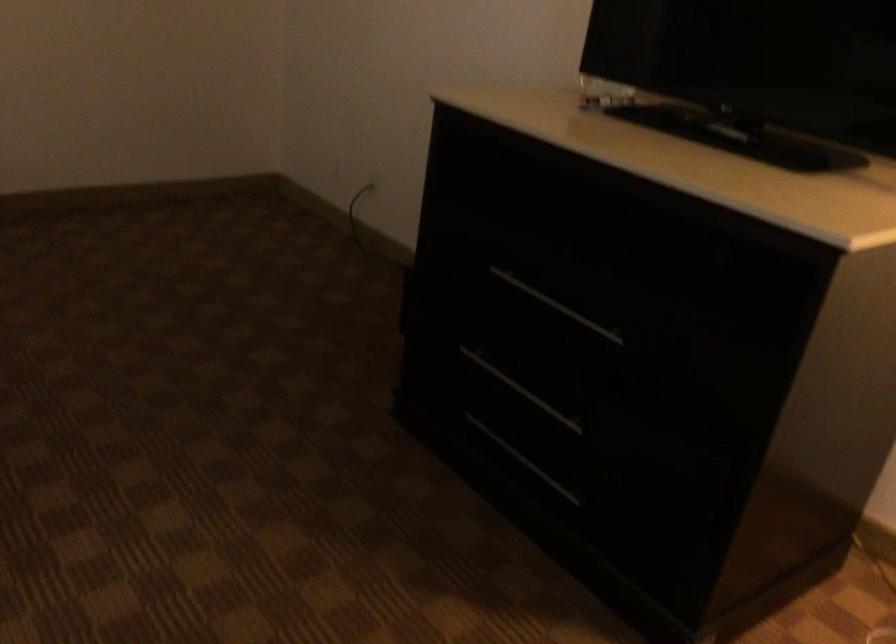
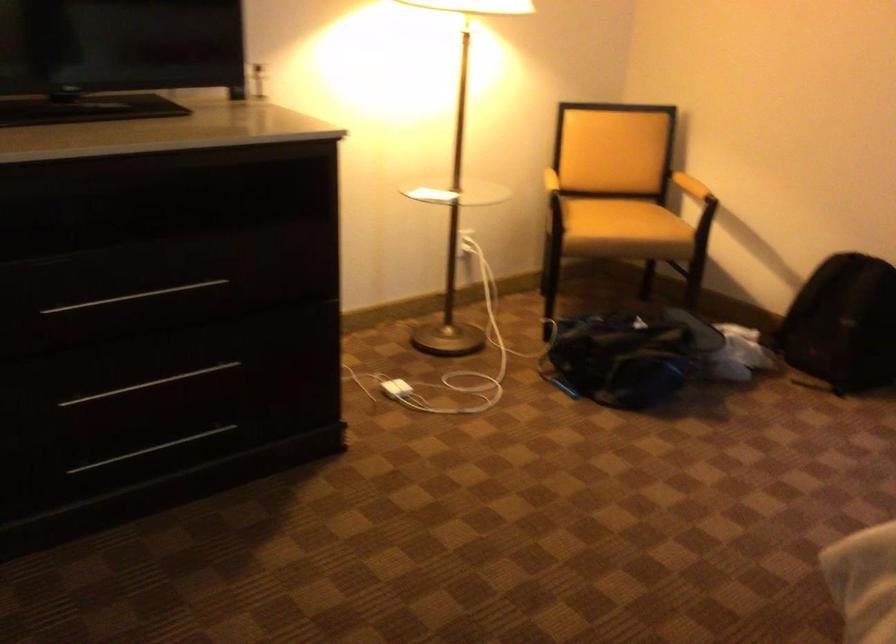
In the second image, find the point that corresponds to point (536, 466) in the first image.

(151, 449)